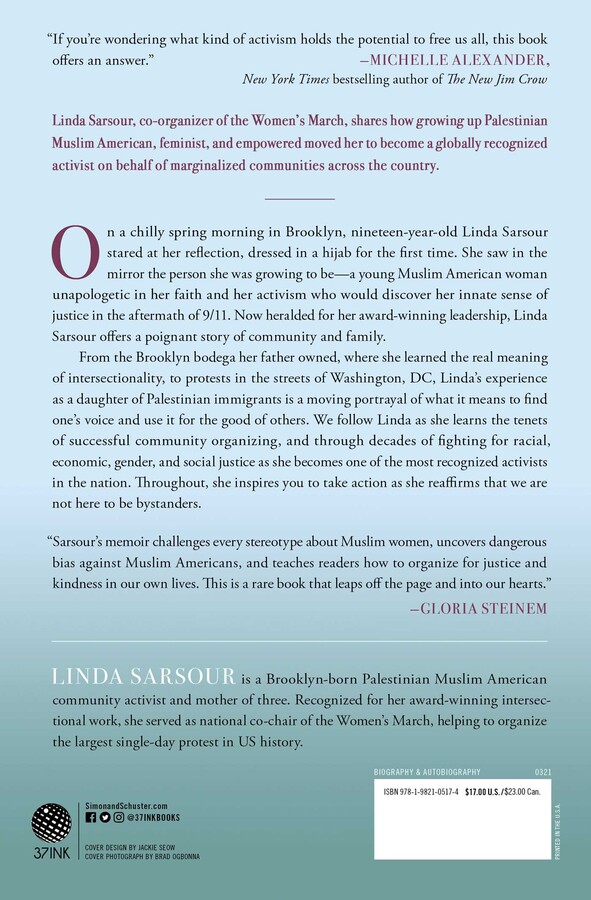
I want to click on book, so click(x=316, y=522).